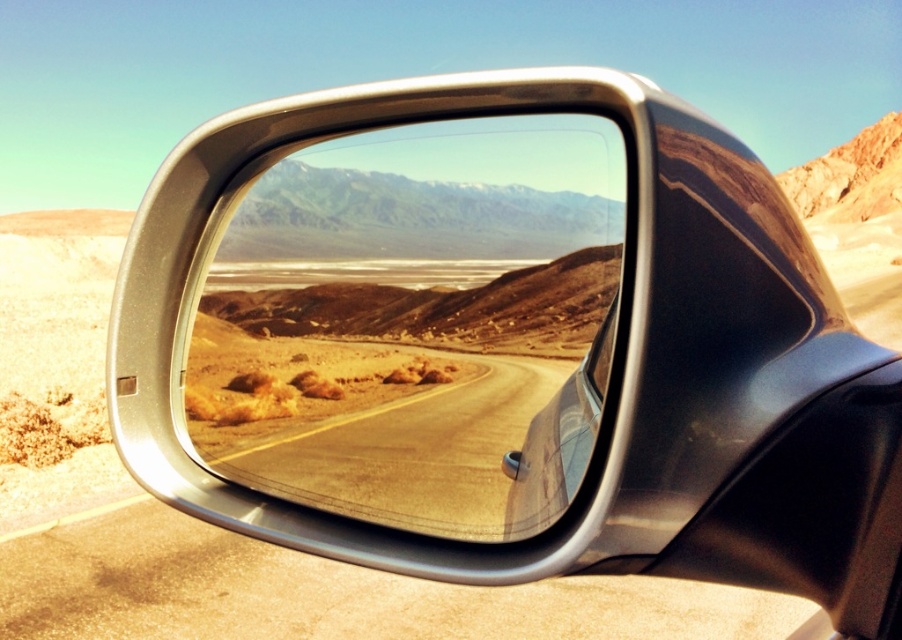
Question: Among these points, which one is nearest to the camera?

Choices:
 (A) (437, 124)
 (B) (311, 419)

Answer: (A)

Question: Which point is farther to the camera?

Choices:
 (A) satin chrome mirror at center
 (B) desert dirt road at center

Answer: (B)

Question: Which of the following is the closest to the observer?

Choices:
 (A) (429, 236)
 (B) (588, 412)

Answer: (B)

Question: Does satin chrome mirror at center appear on the right side of desert dirt road at center?

Choices:
 (A) no
 (B) yes

Answer: (B)

Question: Is satin chrome mirror at center positioned before desert dirt road at center?

Choices:
 (A) no
 (B) yes

Answer: (B)

Question: Does satin chrome mirror at center lie behind desert dirt road at center?

Choices:
 (A) yes
 (B) no

Answer: (B)